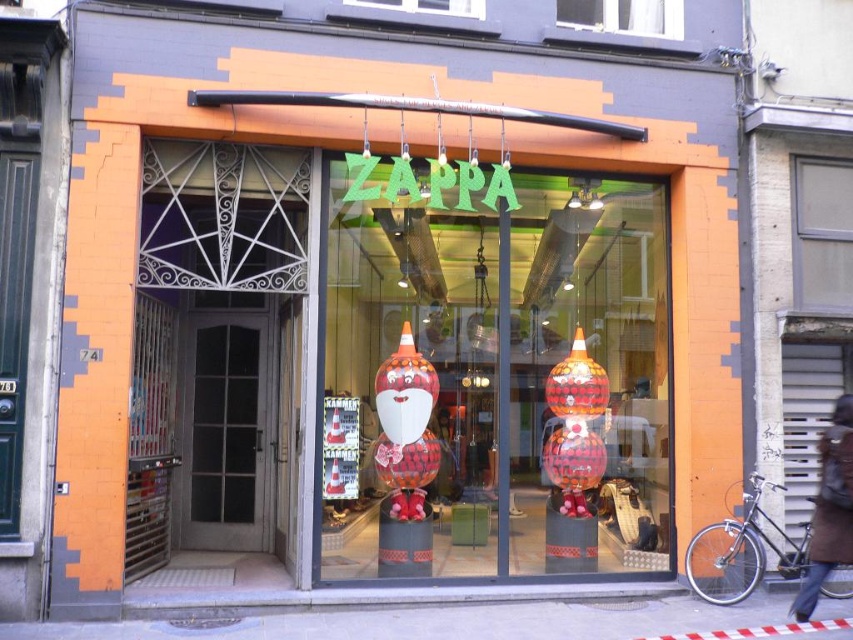
Question: Among these points, which one is farthest from the camera?

Choices:
 (A) (828, 468)
 (B) (837, 173)

Answer: (B)

Question: Can you confirm if matte red santa at center is positioned above brown leather coat at lower right?

Choices:
 (A) no
 (B) yes

Answer: (A)

Question: Estimate the real-world distances between objects in this image. Which object is farther from the transparent glass window at upper right?

Choices:
 (A) transparent glass window at upper center
 (B) brown leather coat at lower right
 (C) matte red santa at center
 (D) transparent glass window at center

Answer: (C)

Question: Can you confirm if transparent glass window at upper right is thinner than brown leather coat at lower right?

Choices:
 (A) yes
 (B) no

Answer: (B)

Question: Is transparent glass window at upper center thinner than transparent glass window at center?

Choices:
 (A) yes
 (B) no

Answer: (A)

Question: Which point appears farthest from the camera in this image?

Choices:
 (A) (817, 545)
 (B) (389, 570)
 (C) (367, 1)
 (D) (639, 20)

Answer: (D)